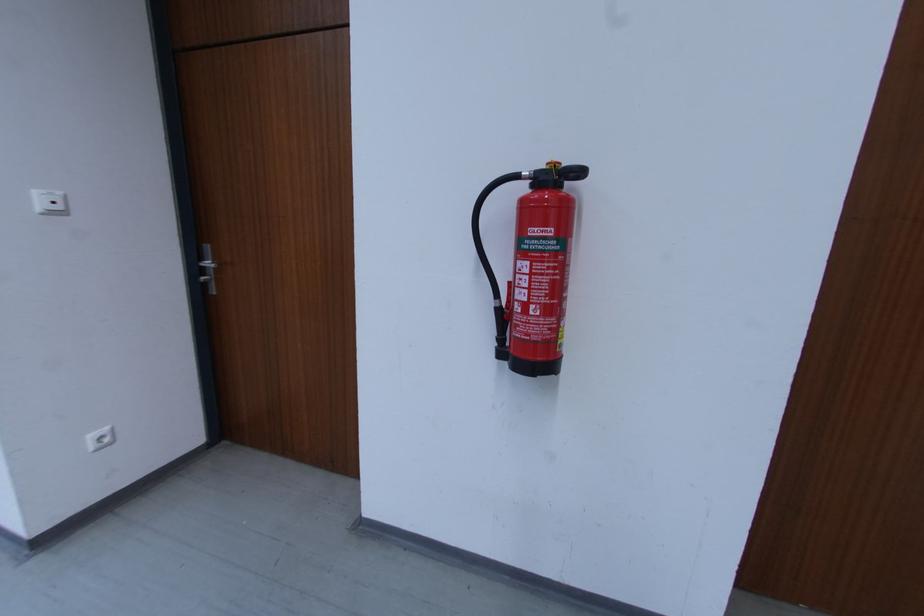
Identify the location of silver door handle. This screenshot has height=616, width=924. (207, 268).